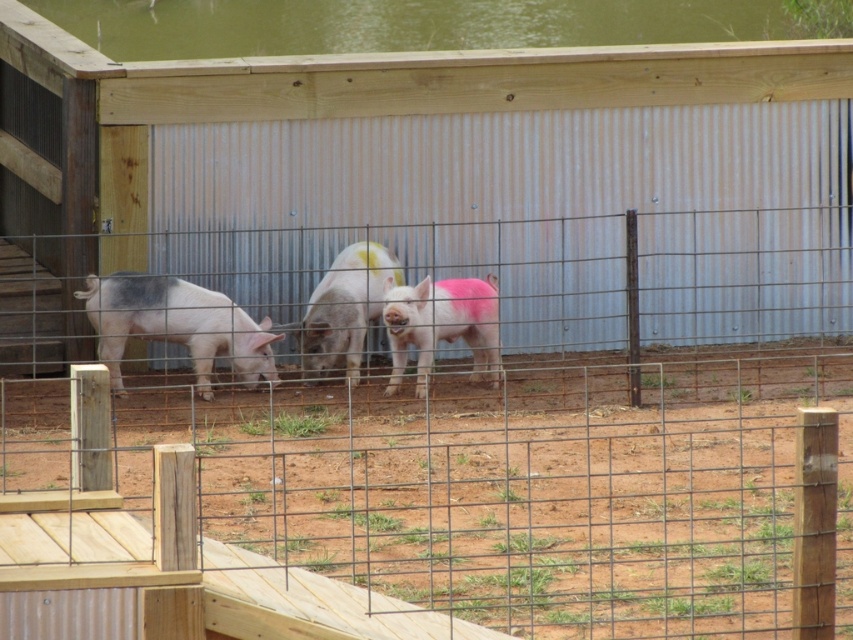
Question: Is green water at upper center above pink matte piglet at center?

Choices:
 (A) yes
 (B) no

Answer: (A)

Question: Does green water at upper center appear over pink matte pig at center?

Choices:
 (A) no
 (B) yes

Answer: (B)

Question: Which object appears closest to the camera in this image?

Choices:
 (A) pink matte piglet at center
 (B) green water at upper center
 (C) gray matte pig at center
 (D) pink matte pig at center

Answer: (A)

Question: Among these objects, which one is nearest to the camera?

Choices:
 (A) gray matte pig at center
 (B) green water at upper center

Answer: (A)

Question: Which point is farther to the camera?

Choices:
 (A) (450, 22)
 (B) (173, 300)
 (C) (345, 307)
 (D) (390, 380)

Answer: (A)

Question: Does pink matte piglet at center have a larger size compared to pink matte pig at center?

Choices:
 (A) no
 (B) yes

Answer: (A)